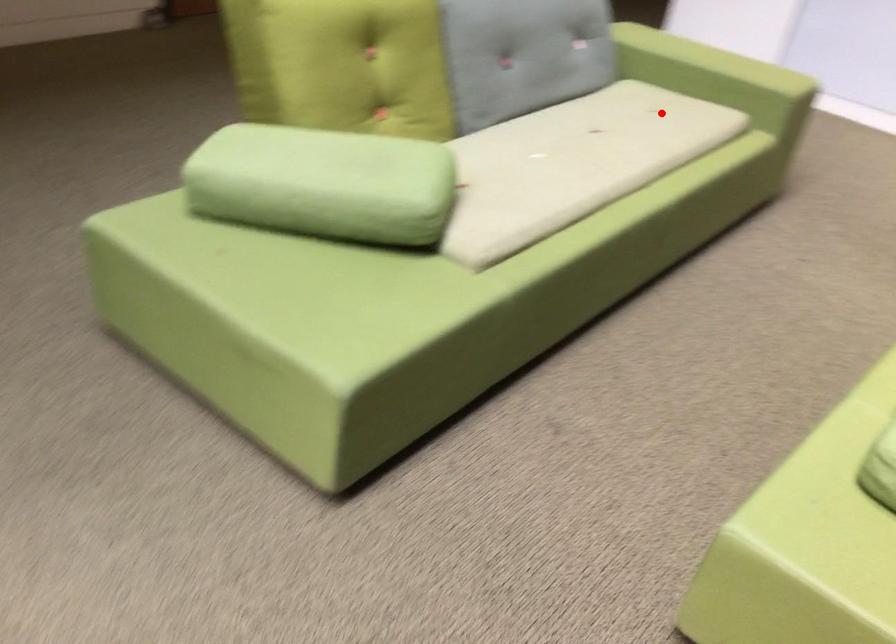
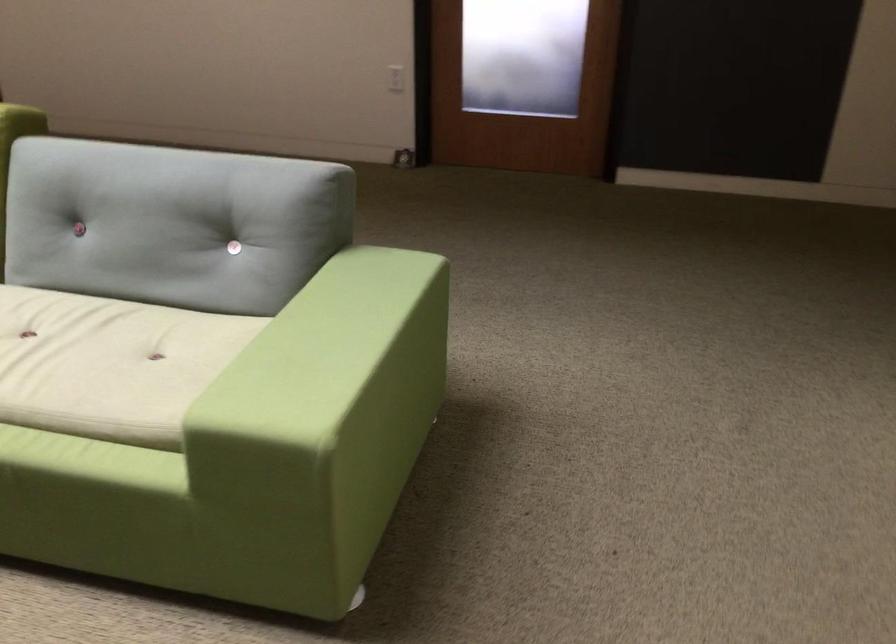
Locate, in the second image, the point that corresponds to the highlighted location in the first image.

(109, 364)